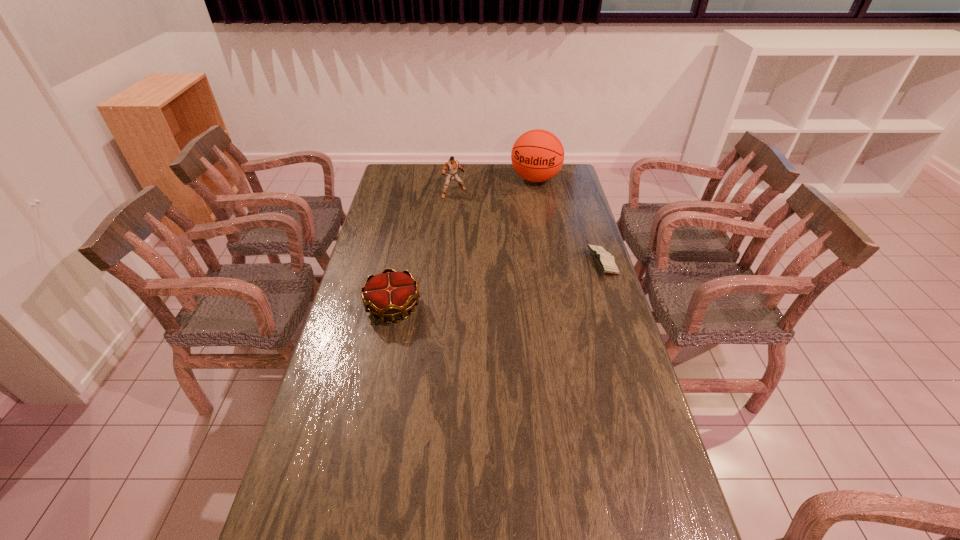
Where is `vacant space located 0.350m on the side with logo of the tallest object`? The width and height of the screenshot is (960, 540). vacant space located 0.350m on the side with logo of the tallest object is located at coordinates (513, 235).

This screenshot has width=960, height=540. Identify the location of vacant space located 0.110m on the side with logo of the tallest object. (525, 204).

Locate an element on the screen. vacant position located 0.190m on the side with logo of the tallest object is located at coordinates (521, 214).

The image size is (960, 540). In order to click on vacant space located on the front-facing side of the third object from right to left in this screenshot , I will do `click(469, 211)`.

At what (x,y) coordinates should I click in order to perform the action: click on vacant space located 0.050m on the front-facing side of the third object from right to left. Please return your answer as a coordinate pair (x, y). The image size is (960, 540). Looking at the image, I should click on (464, 204).

Identify the location of free space located on the front-facing side of the third object from right to left. (482, 225).

The width and height of the screenshot is (960, 540). Find the location of `basketball that is at the far edge`. basketball that is at the far edge is located at coordinates (537, 155).

Identify the location of puncher that is positioned at the far edge. This screenshot has width=960, height=540. (452, 165).

Locate an element on the screen. object present at the left edge is located at coordinates (387, 295).

Find the location of a particular element. diary located at the right edge is located at coordinates (604, 259).